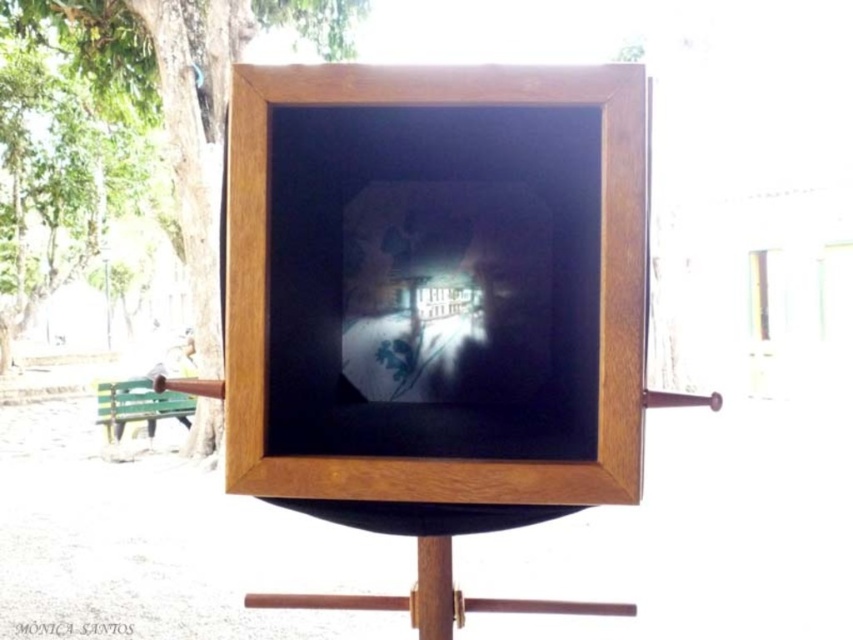
Is the position of smooth brown tree trunk at left more distant than that of green painted wood park bench at lower left?

No, smooth brown tree trunk at left is in front of green painted wood park bench at lower left.

Where is `smooth brown tree trunk at left`? smooth brown tree trunk at left is located at coordinates (183, 88).

I want to click on smooth brown tree trunk at left, so click(x=183, y=88).

This screenshot has height=640, width=853. Find the location of `smooth brown tree trunk at left`. smooth brown tree trunk at left is located at coordinates [183, 88].